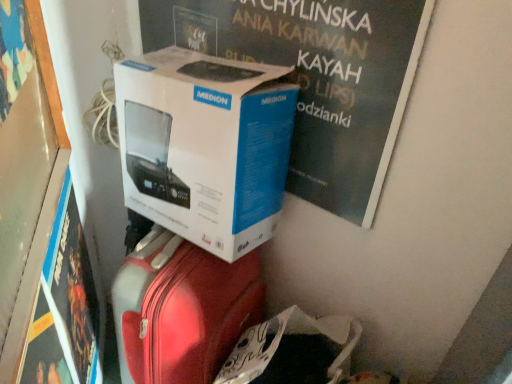
Question: Should I look upward or downward to see white cardboard box at upper center, positioned as the second magazine in bottom-to-top order?

Choices:
 (A) down
 (B) up

Answer: (B)

Question: From the image's perspective, is wooden frame at left on white cardboard box at upper center, which is counted as the 2th magazine, starting from the left?

Choices:
 (A) yes
 (B) no

Answer: (B)

Question: Considering the relative positions of wooden frame at left and white cardboard box at upper center, the first magazine from the right, in the image provided, is wooden frame at left to the right of white cardboard box at upper center, the first magazine from the right, from the viewer's perspective?

Choices:
 (A) no
 (B) yes

Answer: (A)

Question: From the image's perspective, is wooden frame at left beneath white cardboard box at upper center, positioned as the second magazine in bottom-to-top order?

Choices:
 (A) yes
 (B) no

Answer: (A)

Question: Considering the relative sizes of wooden frame at left and white cardboard box at upper center, the first magazine from the right, in the image provided, is wooden frame at left smaller than white cardboard box at upper center, the first magazine from the right,?

Choices:
 (A) yes
 (B) no

Answer: (B)

Question: Is wooden frame at left further to camera compared to white cardboard box at upper center, which is counted as the 2th magazine, starting from the left?

Choices:
 (A) yes
 (B) no

Answer: (B)

Question: Does wooden frame at left have a larger size compared to white cardboard box at upper center, which is counted as the 2th magazine, starting from the left?

Choices:
 (A) no
 (B) yes

Answer: (B)

Question: Is white cardboard box at center facing away from wooden frame at left?

Choices:
 (A) yes
 (B) no

Answer: (B)

Question: Is white cardboard box at center positioned beyond the bounds of wooden frame at left?

Choices:
 (A) no
 (B) yes

Answer: (B)

Question: From a real-world perspective, is white cardboard box at center located higher than wooden frame at left?

Choices:
 (A) yes
 (B) no

Answer: (A)

Question: From a real-world perspective, does white cardboard box at center sit lower than wooden frame at left?

Choices:
 (A) yes
 (B) no

Answer: (B)

Question: Is white cardboard box at center in contact with wooden frame at left?

Choices:
 (A) yes
 (B) no

Answer: (B)

Question: Is white cardboard box at center bigger than wooden frame at left?

Choices:
 (A) yes
 (B) no

Answer: (B)

Question: Could you tell me if white cardboard box at upper center, positioned as the second magazine in bottom-to-top order, is facing matte black magazine at lower left, the 1th magazine from the left?

Choices:
 (A) yes
 (B) no

Answer: (B)